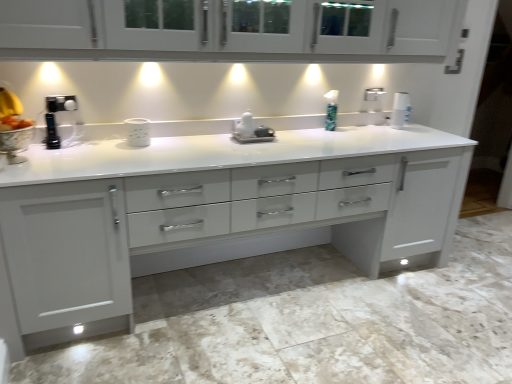
Question: From the image's perspective, is white glossy countertop at center positioned above or below green plastic soap dispenser at center?

Choices:
 (A) below
 (B) above

Answer: (A)

Question: In terms of width, does white glossy countertop at center look wider or thinner when compared to green plastic soap dispenser at center?

Choices:
 (A) wide
 (B) thin

Answer: (A)

Question: Based on their relative distances, which object is nearer to the white glossy paper towel at upper right?

Choices:
 (A) green plastic soap dispenser at center
 (B) white glossy cabinet at upper center
 (C) white glossy mug at center, the 1th appliance in the front-to-back sequence
 (D) white glossy coffee maker at center, the 1th appliance viewed from the back
 (E) white glossy countertop at center

Answer: (A)

Question: Which is nearer to the white glossy mug at center, which ranks as the 1th appliance in left-to-right order?

Choices:
 (A) white glossy cabinet at upper center
 (B) green plastic soap dispenser at center
 (C) white glossy paper towel at upper right
 (D) white glossy coffee maker at center, which ranks as the 2th appliance in left-to-right order
 (E) white glossy countertop at center

Answer: (D)